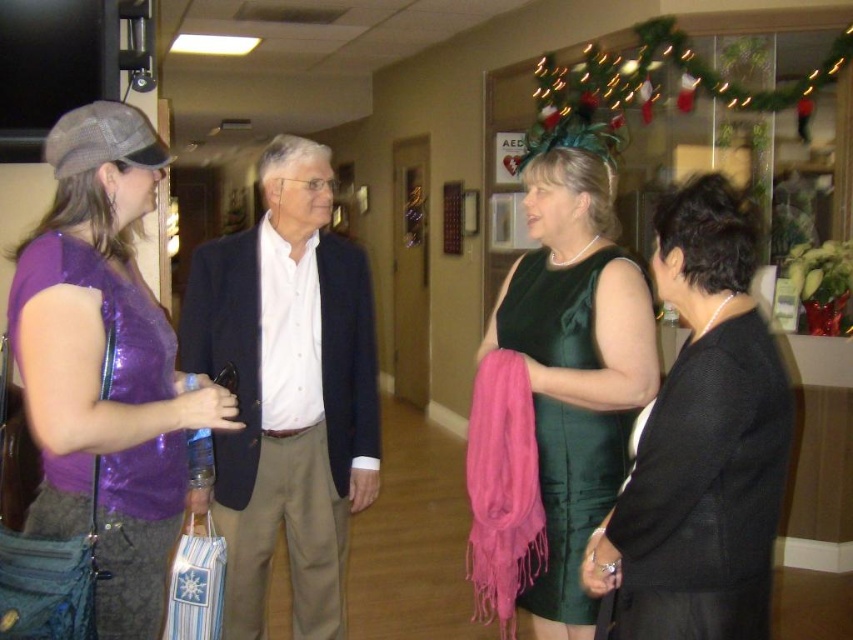
You are a fashion designer who needs to place a new dress between the matte black dress at right and the green velvet dress at center. Given the space between them is 37.33 centimeters, can you fit a dress that is 40 centimeters wide?

The space between the matte black dress at right and the green velvet dress at center is 37.33 centimeters, which is narrower than the 40 centimeter width of the new dress. Therefore, the dress cannot be placed between them without overlapping.

You are a fashion designer observing the scene. You need to determine if the distance between the shiny purple top at left and the green velvet dress at center is sufficient to fit a 36 inch wide mannequin between them. Can you confirm?

The shiny purple top at left and green velvet dress at center are 35.15 inches apart, so the 36 inch wide mannequin cannot fit between them as the space is slightly narrower than required.

You are a fashion designer observing the scene and want to create a new collection based on the dresses seen. Which dress, the matte black dress at right or the green velvet dress at center, would you choose if you want to highlight a shorter silhouette?

The matte black dress at right is shorter than the green velvet dress at center, so it would be the better choice to highlight a shorter silhouette.